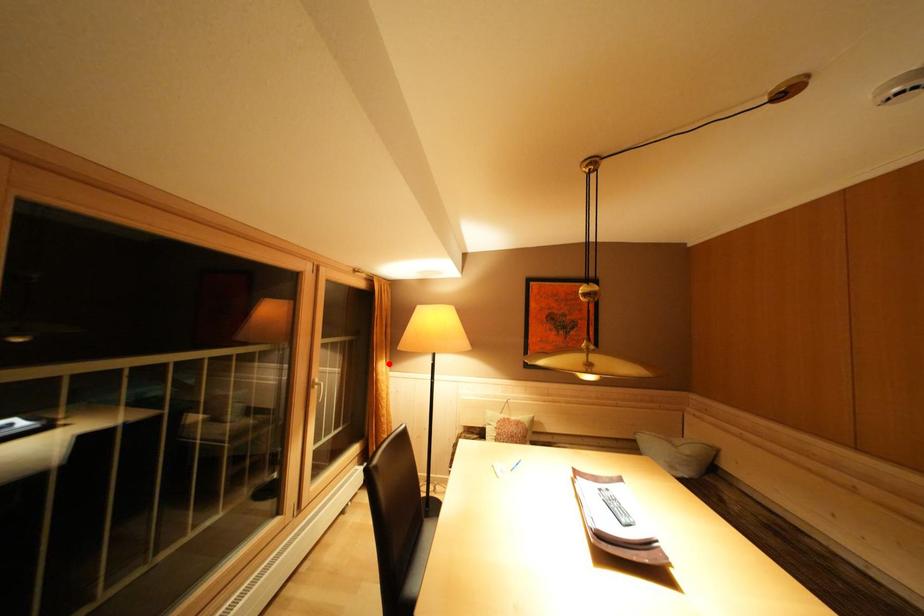
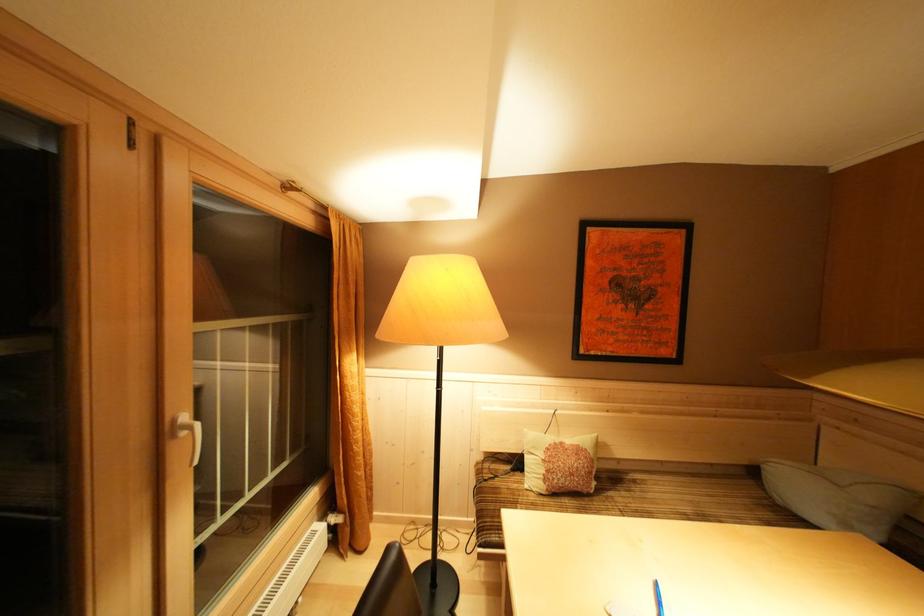
Question: I am providing you with two images of the same scene from different viewpoints. Image1 has a red point marked. In image2, the corresponding 3D location appears at what relative position? Reply with the corresponding letter.

Choices:
 (A) Closer
 (B) Farther

Answer: (A)